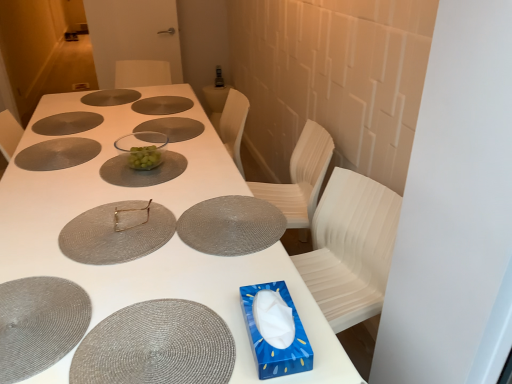
This screenshot has width=512, height=384. Identify the location of free space that is in between matte gray glass plate at upper left, which is the 5th glass plate in back-to-front order, and matte gray placemat at center, placed as the seventh glass plate when sorted from back to front. (124, 174).